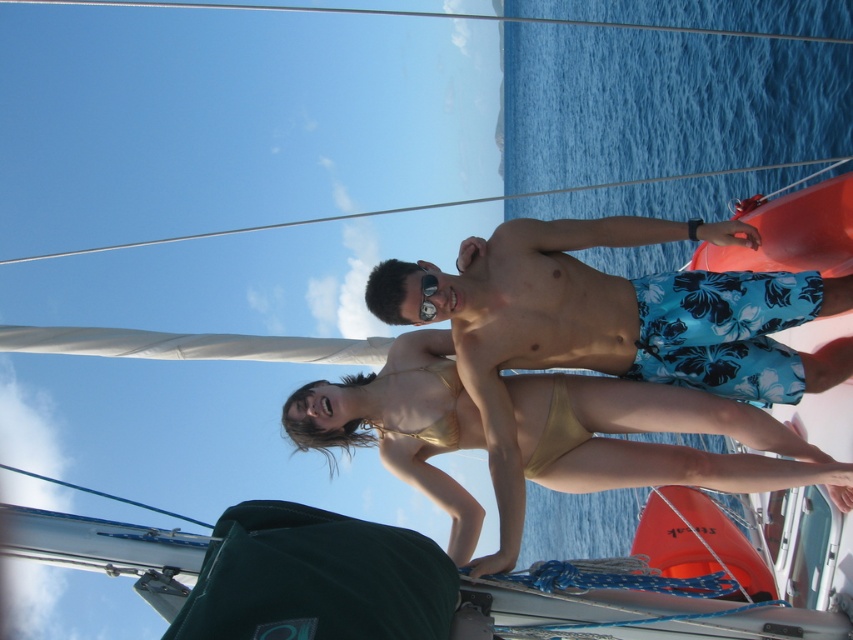
Does blue floral swim trunks at right have a greater width compared to matte black goggles at center?

Yes, blue floral swim trunks at right is wider than matte black goggles at center.

In order to click on blue floral swim trunks at right in this screenshot , I will do `click(795, 232)`.

Is blue floral swim trunks at center closer to camera compared to gold/yellow bikini bottom at center?

No, blue floral swim trunks at center is behind gold/yellow bikini bottom at center.

Based on the photo, is blue floral swim trunks at center thinner than gold/yellow bikini bottom at center?

No.

Where is `blue floral swim trunks at center`? This screenshot has height=640, width=853. blue floral swim trunks at center is located at coordinates (621, 310).

Locate an element on the screen. The image size is (853, 640). blue floral swim trunks at center is located at coordinates (621, 310).

Locate an element on the screen. The width and height of the screenshot is (853, 640). blue floral swim trunks at center is located at coordinates (621, 310).

Which is above, blue floral swim trunks at center or blue floral swim trunks at right?

blue floral swim trunks at center is above.

Where is `blue floral swim trunks at center`? This screenshot has width=853, height=640. blue floral swim trunks at center is located at coordinates (621, 310).

This screenshot has height=640, width=853. What are the coordinates of `blue floral swim trunks at center` in the screenshot? It's located at (621, 310).